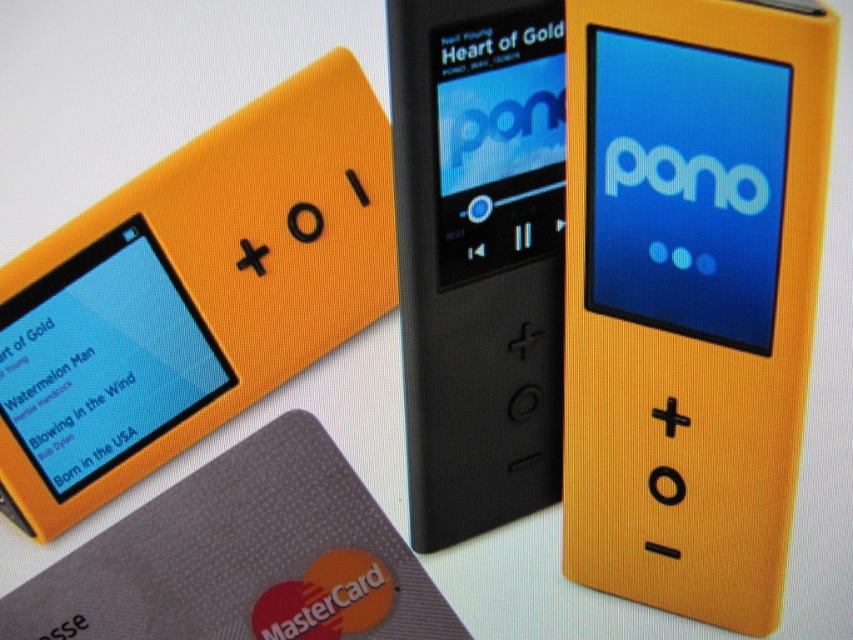
You are organizing a music festival and need to display two devices on a table. The orange matte ipod at center and the orange matte plastic pono at upper left. If you want to arrange them vertically so that the taller one is on top, which device should you place above the other?

The orange matte ipod at center is much taller than the orange matte plastic pono at upper left, so you should place the orange matte ipod at center above the orange matte plastic pono at upper left.

You are holding an orange matte ipod at center and a black matte mp3 player at center. Which device is positioned closer to you?

The orange matte ipod at center is closer to the viewer than the black matte mp3 player at center.